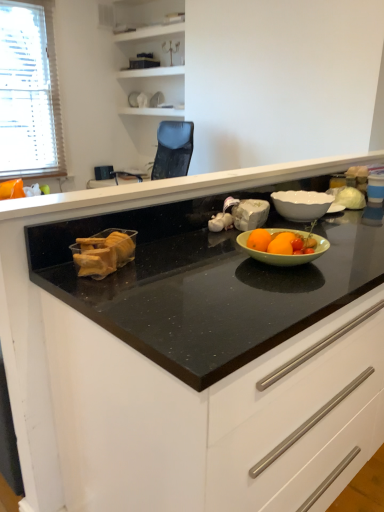
Question: Can you confirm if black granite countertop at center is smaller than white glossy bowl at upper right?

Choices:
 (A) yes
 (B) no

Answer: (B)

Question: Is black granite countertop at center behind white glossy bowl at upper right?

Choices:
 (A) no
 (B) yes

Answer: (A)

Question: Is white glossy bowl at upper right located within black granite countertop at center?

Choices:
 (A) yes
 (B) no

Answer: (A)

Question: Does black granite countertop at center appear on the right side of white glossy bowl at upper right?

Choices:
 (A) yes
 (B) no

Answer: (A)

Question: From the image's perspective, is black granite countertop at center located above white glossy bowl at upper right?

Choices:
 (A) yes
 (B) no

Answer: (B)

Question: Is black granite countertop at center inside the boundaries of translucent plastic baguette at left, or outside?

Choices:
 (A) outside
 (B) inside

Answer: (A)

Question: Based on their positions, is black granite countertop at center located to the left or right of translucent plastic baguette at left?

Choices:
 (A) left
 (B) right

Answer: (B)

Question: Looking at their shapes, would you say black granite countertop at center is wider or thinner than translucent plastic baguette at left?

Choices:
 (A) wide
 (B) thin

Answer: (A)

Question: Is point (220, 178) positioned closer to the camera than point (97, 274)?

Choices:
 (A) closer
 (B) farther

Answer: (B)

Question: Is white glossy bowl at upper right bigger or smaller than black granite countertop at center?

Choices:
 (A) big
 (B) small

Answer: (B)

Question: In terms of width, does white glossy bowl at upper right look wider or thinner when compared to black granite countertop at center?

Choices:
 (A) thin
 (B) wide

Answer: (A)

Question: Considering the positions of white glossy bowl at upper right and black granite countertop at center in the image, is white glossy bowl at upper right taller or shorter than black granite countertop at center?

Choices:
 (A) tall
 (B) short

Answer: (B)

Question: From the image's perspective, is white glossy bowl at upper right located above or below black granite countertop at center?

Choices:
 (A) below
 (B) above

Answer: (B)

Question: Would you say white blinds at left is to the left or to the right of black granite countertop at center in the picture?

Choices:
 (A) right
 (B) left

Answer: (B)

Question: Looking at their shapes, would you say white blinds at left is wider or thinner than black granite countertop at center?

Choices:
 (A) wide
 (B) thin

Answer: (A)